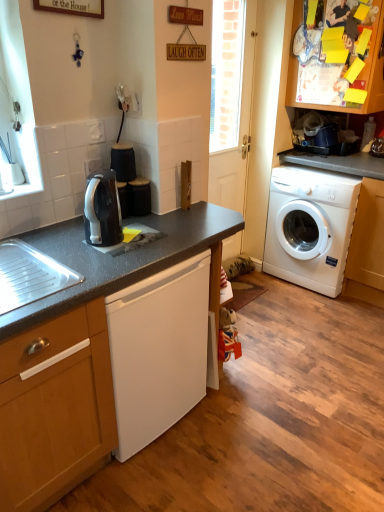
Where is `unoccupied space behind black glossy kettle at upper left`? The width and height of the screenshot is (384, 512). unoccupied space behind black glossy kettle at upper left is located at coordinates (137, 223).